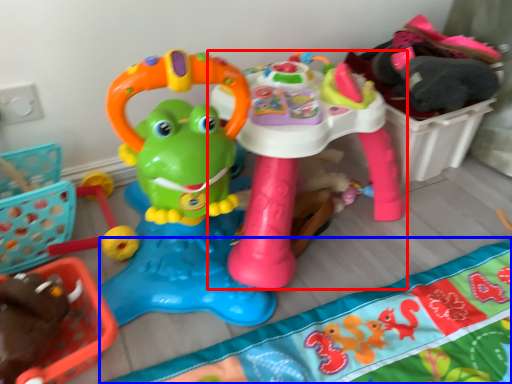
Question: Which object appears closest to the camera in this image, toy (highlighted by a red box) or blanket (highlighted by a blue box)?

Choices:
 (A) toy
 (B) blanket

Answer: (B)